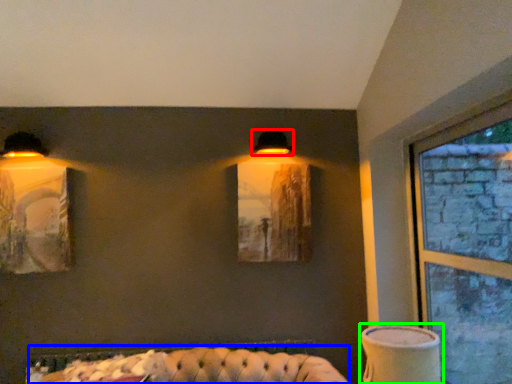
Question: Which object is positioned closest to lamp (highlighted by a red box)? Select from couch (highlighted by a blue box) and table lamp (highlighted by a green box).

Choices:
 (A) couch
 (B) table lamp

Answer: (B)